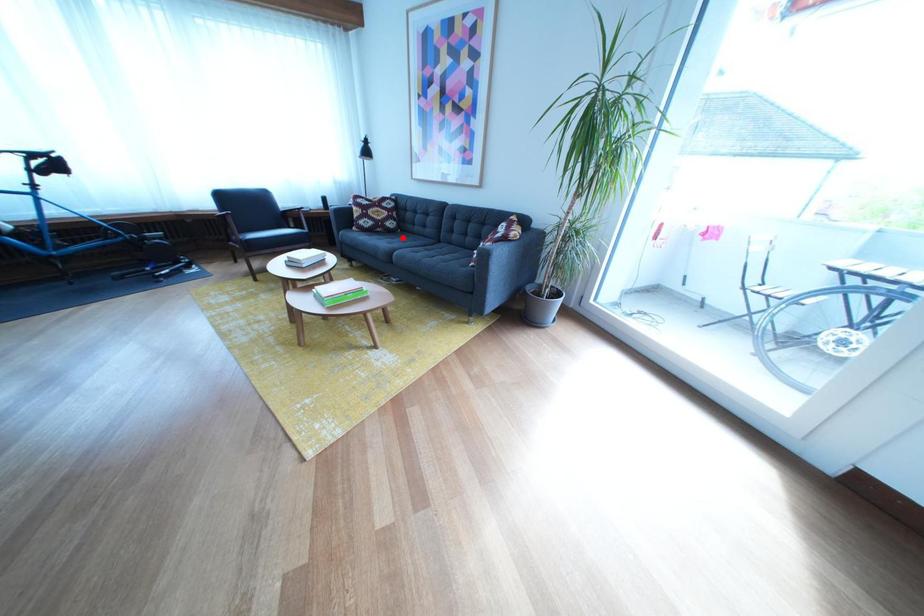
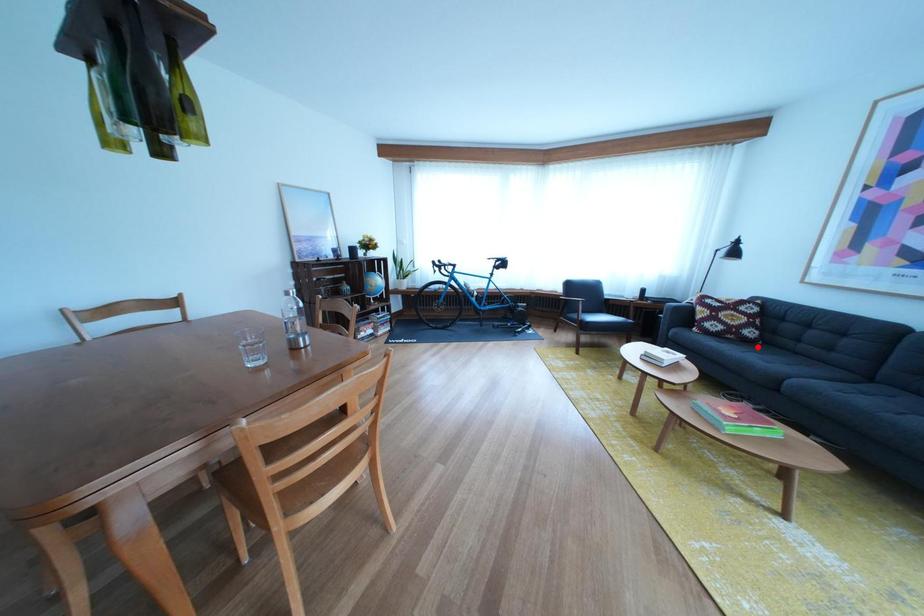
I am providing you with two images of the same scene from different viewpoints. A red point is marked on the first image and another point is marked on the second image. Does the point marked in image1 correspond to the same location as the one in image2?

Yes